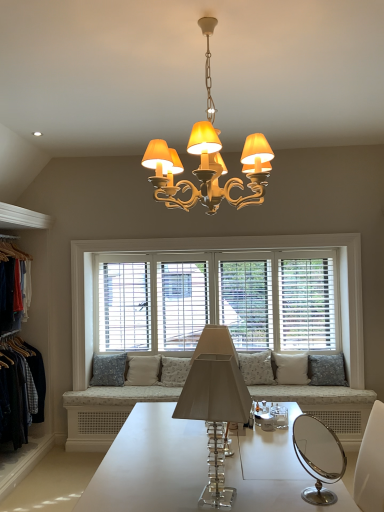
Locate an element on the screen. The height and width of the screenshot is (512, 384). clear acrylic lamp at center, positioned as the first lamp in bottom-to-top order is located at coordinates (x=215, y=415).

This screenshot has height=512, width=384. What do you see at coordinates (327, 370) in the screenshot?
I see `gray fabric pillow at right, which is counted as the 1th pillow, starting from the right` at bounding box center [327, 370].

What do you see at coordinates (109, 370) in the screenshot? The width and height of the screenshot is (384, 512). I see `floral fabric pillow at center, marked as the 1th pillow in a left-to-right arrangement` at bounding box center [109, 370].

You are a GUI agent. You are given a task and a screenshot of the screen. Output one action in this format:
    pyautogui.click(x=<x>, y=<y>)
    Task: Click on the matte gold chandelier at center, which appears as the second lamp when ordered from the bottom
    Image resolution: width=384 pixels, height=512 pixels.
    Given the screenshot: What is the action you would take?
    pyautogui.click(x=209, y=159)

The width and height of the screenshot is (384, 512). What do you see at coordinates (209, 159) in the screenshot? I see `matte gold chandelier at center, which appears as the second lamp when ordered from the bottom` at bounding box center [209, 159].

What is the approximate height of white fabric pillow at right, arranged as the 2th pillow when viewed from the right?

white fabric pillow at right, arranged as the 2th pillow when viewed from the right, is 39.08 centimeters in height.

Measure the distance between point (267, 380) and camera.

Point (267, 380) and camera are 4.39 meters apart from each other.

You are a GUI agent. You are given a task and a screenshot of the screen. Output one action in this format:
    pyautogui.click(x=<x>, y=<y>)
    Task: Click on the clear acrylic lamp at center, positioned as the first lamp in bottom-to-top order
    The height and width of the screenshot is (512, 384).
    Given the screenshot: What is the action you would take?
    pyautogui.click(x=215, y=415)

Which is in front, clear acrylic lamp at center, the second lamp positioned from the top, or gray fabric pillow at right, which is counted as the 1th pillow, starting from the right?

clear acrylic lamp at center, the second lamp positioned from the top.

Is clear acrylic lamp at center, positioned as the first lamp in bottom-to-top order, positioned with its back to gray fabric pillow at right, placed as the sixth pillow when sorted from left to right?

No, gray fabric pillow at right, placed as the sixth pillow when sorted from left to right, is not at the back of clear acrylic lamp at center, positioned as the first lamp in bottom-to-top order.

Can you tell me how much clear acrylic lamp at center, positioned as the first lamp in bottom-to-top order, and gray fabric pillow at right, placed as the sixth pillow when sorted from left to right, differ in facing direction?

clear acrylic lamp at center, positioned as the first lamp in bottom-to-top order, and gray fabric pillow at right, placed as the sixth pillow when sorted from left to right, are facing 98.8 degrees away from each other.

In order to click on the 1st pillow to the right of the matte gold chandelier at center, which is counted as the 1th lamp, starting from the top, counting from the anchor's position in this screenshot , I will do `click(256, 368)`.

From a real-world perspective, relative to floral fabric pillow at center, which is counted as the 4th pillow, starting from the left, is matte gold chandelier at center, which appears as the second lamp when ordered from the bottom, vertically above or below?

Clearly, from a real-world perspective, matte gold chandelier at center, which appears as the second lamp when ordered from the bottom, is above floral fabric pillow at center, which is counted as the 4th pillow, starting from the left.

From the image's perspective, would you say matte gold chandelier at center, which appears as the second lamp when ordered from the bottom, is positioned over floral fabric pillow at center, acting as the 3th pillow starting from the right?

Yes, from the image's perspective, matte gold chandelier at center, which appears as the second lamp when ordered from the bottom, is above floral fabric pillow at center, acting as the 3th pillow starting from the right.

Which of these two, matte gold chandelier at center, which appears as the second lamp when ordered from the bottom, or floral fabric pillow at center, which is counted as the 4th pillow, starting from the left, is smaller?

floral fabric pillow at center, which is counted as the 4th pillow, starting from the left, is smaller.

Is clear acrylic lamp at center, the second lamp positioned from the top, a part of matte gold chandelier at center, which appears as the second lamp when ordered from the bottom?

No.

Is matte gold chandelier at center, which appears as the second lamp when ordered from the bottom, looking in the opposite direction of clear acrylic lamp at center, the second lamp positioned from the top?

That's not correct — matte gold chandelier at center, which appears as the second lamp when ordered from the bottom, is not looking away from clear acrylic lamp at center, the second lamp positioned from the top.

Is matte gold chandelier at center, which appears as the second lamp when ordered from the bottom, wider or thinner than clear acrylic lamp at center, the second lamp positioned from the top?

matte gold chandelier at center, which appears as the second lamp when ordered from the bottom, is wider than clear acrylic lamp at center, the second lamp positioned from the top.

From a real-world perspective, is white wood window at center beneath white fabric pillow at right, arranged as the 2th pillow when viewed from the right?

Actually, white wood window at center is physically above white fabric pillow at right, arranged as the 2th pillow when viewed from the right, in the real world.

Based on the photo, from the image's perspective, is white wood window at center above or below white fabric pillow at right, the fifth pillow when ordered from left to right?

From the image's perspective, white wood window at center appears above white fabric pillow at right, the fifth pillow when ordered from left to right.

Identify the location of window above the white fabric pillow at right, the fifth pillow when ordered from left to right (from the image's perspective). The width and height of the screenshot is (384, 512). (234, 250).

Is white wood window at center wider than white fabric pillow at right, the fifth pillow when ordered from left to right?

No, white wood window at center is not wider than white fabric pillow at right, the fifth pillow when ordered from left to right.

Between white fabric pillow at right, arranged as the 2th pillow when viewed from the right, and clear acrylic lamp at center, positioned as the first lamp in bottom-to-top order, which one is positioned in front?

A: clear acrylic lamp at center, positioned as the first lamp in bottom-to-top order.

Is white fabric pillow at right, the fifth pillow when ordered from left to right, looking in the opposite direction of clear acrylic lamp at center, positioned as the first lamp in bottom-to-top order?

That's not correct — white fabric pillow at right, the fifth pillow when ordered from left to right, is not looking away from clear acrylic lamp at center, positioned as the first lamp in bottom-to-top order.

Is clear acrylic lamp at center, positioned as the first lamp in bottom-to-top order, surrounded by white fabric pillow at right, the fifth pillow when ordered from left to right?

That's incorrect, clear acrylic lamp at center, positioned as the first lamp in bottom-to-top order, is not inside white fabric pillow at right, the fifth pillow when ordered from left to right.

Which of these two, white fabric pillow at right, the fifth pillow when ordered from left to right, or clear acrylic lamp at center, the second lamp positioned from the top, stands shorter?

With less height is white fabric pillow at right, the fifth pillow when ordered from left to right.

From a real-world perspective, which is physically below, matte gold chandelier at center, which is counted as the 1th lamp, starting from the top, or gray fabric pillow at right, which is counted as the 1th pillow, starting from the right?

gray fabric pillow at right, which is counted as the 1th pillow, starting from the right.

How different are the orientations of matte gold chandelier at center, which is counted as the 1th lamp, starting from the top, and gray fabric pillow at right, which is counted as the 1th pillow, starting from the right, in degrees?

They differ by 7.18 degrees in their facing directions.

In terms of size, does matte gold chandelier at center, which is counted as the 1th lamp, starting from the top, appear bigger or smaller than gray fabric pillow at right, which is counted as the 1th pillow, starting from the right?

Considering their sizes, matte gold chandelier at center, which is counted as the 1th lamp, starting from the top, takes up more space than gray fabric pillow at right, which is counted as the 1th pillow, starting from the right.

Is matte gold chandelier at center, which appears as the second lamp when ordered from the bottom, facing away from gray fabric pillow at right, placed as the sixth pillow when sorted from left to right?

No, matte gold chandelier at center, which appears as the second lamp when ordered from the bottom, is not facing away from gray fabric pillow at right, placed as the sixth pillow when sorted from left to right.

Considering the relative positions of denim jacket at left and gray fabric pillow at right, which is counted as the 1th pillow, starting from the right, in the image provided, is denim jacket at left to the left or to the right of gray fabric pillow at right, which is counted as the 1th pillow, starting from the right,?

From the image, it's evident that denim jacket at left is to the left of gray fabric pillow at right, which is counted as the 1th pillow, starting from the right.

Is denim jacket at left bigger than gray fabric pillow at right, placed as the sixth pillow when sorted from left to right?

Yes.

In the image, is denim jacket at left positioned in front of or behind gray fabric pillow at right, placed as the sixth pillow when sorted from left to right?

Clearly, denim jacket at left is in front of gray fabric pillow at right, placed as the sixth pillow when sorted from left to right.

How different are the orientations of denim jacket at left and gray fabric pillow at right, placed as the sixth pillow when sorted from left to right, in degrees?

91.2 degrees.

The image size is (384, 512). I want to click on the 2nd lamp in front of the gray fabric pillow at right, which is counted as the 1th pillow, starting from the right, so click(215, 415).

Find the location of a particular element. Image resolution: width=384 pixels, height=512 pixels. the 1st pillow to the right of the matte gold chandelier at center, which is counted as the 1th lamp, starting from the top, counting from the anchor's position is located at coordinates coord(256,368).

Considering their positions, is denim jacket at left positioned closer to matte gold chandelier at center, which is counted as the 1th lamp, starting from the top, than beige fabric pillow at center, which appears as the 5th pillow when viewed from the right?

Based on the image, denim jacket at left appears to be nearer to matte gold chandelier at center, which is counted as the 1th lamp, starting from the top.

Based on their spatial positions, is white fabric pillow at right, the fifth pillow when ordered from left to right, or matte gold chandelier at center, which is counted as the 1th lamp, starting from the top, further from denim jacket at left?

white fabric pillow at right, the fifth pillow when ordered from left to right, lies further to denim jacket at left than the other object.

Based on their spatial positions, is gray fabric pillow at right, placed as the sixth pillow when sorted from left to right, or floral fabric pillow at center, acting as the 3th pillow starting from the right, closer to white fabric pillow at right, arranged as the 2th pillow when viewed from the right?

gray fabric pillow at right, placed as the sixth pillow when sorted from left to right, is positioned closer to the anchor white fabric pillow at right, arranged as the 2th pillow when viewed from the right.

Looking at the image, which one is located further to white wood window at center, denim jacket at left or clear acrylic lamp at center, the second lamp positioned from the top?

clear acrylic lamp at center, the second lamp positioned from the top.

When comparing their distances from floral fabric pillow at center, acting as the 3th pillow starting from the right, does white wood window at center or matte gold chandelier at center, which appears as the second lamp when ordered from the bottom, seem closer?

The object closer to floral fabric pillow at center, acting as the 3th pillow starting from the right, is white wood window at center.

Based on their spatial positions, is matte gold chandelier at center, which is counted as the 1th lamp, starting from the top, or gray fabric pillow at right, placed as the sixth pillow when sorted from left to right, closer to beige fabric pillow at center, which appears as the 5th pillow when viewed from the right?

Based on the image, gray fabric pillow at right, placed as the sixth pillow when sorted from left to right, appears to be nearer to beige fabric pillow at center, which appears as the 5th pillow when viewed from the right.

Considering their positions, is floral fabric pillow at center, marked as the 1th pillow in a left-to-right arrangement, positioned further to floral fabric pillow at center, acting as the 3th pillow starting from the right, than floral fabric pillow at center, the 3th pillow in the left-to-right sequence?

floral fabric pillow at center, marked as the 1th pillow in a left-to-right arrangement, is positioned further to the anchor floral fabric pillow at center, acting as the 3th pillow starting from the right.

Considering their positions, is clear acrylic lamp at center, positioned as the first lamp in bottom-to-top order, positioned closer to beige fabric pillow at center, which ranks as the second pillow in left-to-right order, than white wood window at center?

white wood window at center lies closer to beige fabric pillow at center, which ranks as the second pillow in left-to-right order, than the other object.

The image size is (384, 512). Identify the location of pillow located between denim jacket at left and beige fabric pillow at center, which appears as the 5th pillow when viewed from the right, in the left-right direction. (109, 370).

The height and width of the screenshot is (512, 384). Identify the location of window between floral fabric pillow at center, the 3th pillow in the left-to-right sequence, and floral fabric pillow at center, which is counted as the 4th pillow, starting from the left, from left to right. (234, 250).

Locate an element on the screen. pillow between clear acrylic lamp at center, positioned as the first lamp in bottom-to-top order, and white fabric pillow at right, the fifth pillow when ordered from left to right, along the z-axis is located at coordinates (327, 370).

Identify the location of lamp between clear acrylic lamp at center, the second lamp positioned from the top, and beige fabric pillow at center, which ranks as the second pillow in left-to-right order, in the front-back direction. (209, 159).